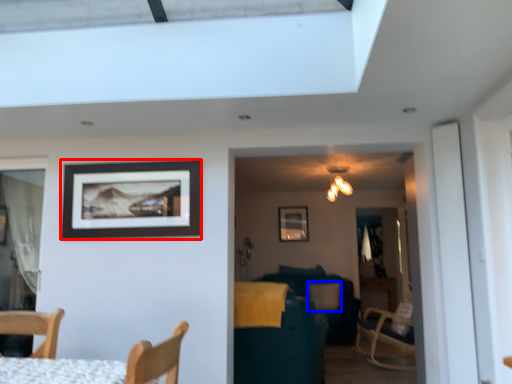
Question: Which object appears farthest to the camera in this image, picture frame (highlighted by a red box) or pillow (highlighted by a blue box)?

Choices:
 (A) picture frame
 (B) pillow

Answer: (B)